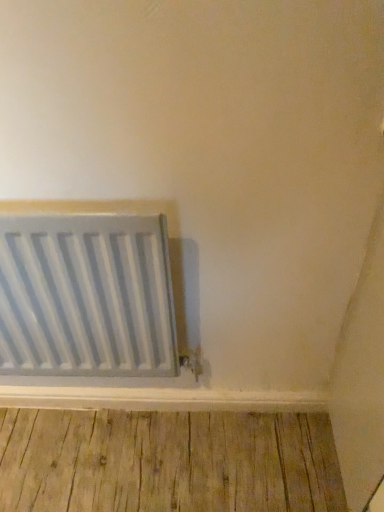
Where is `vacant region below metallic silver radiator at lower left (from a real-world perspective)`? vacant region below metallic silver radiator at lower left (from a real-world perspective) is located at coordinates (110, 421).